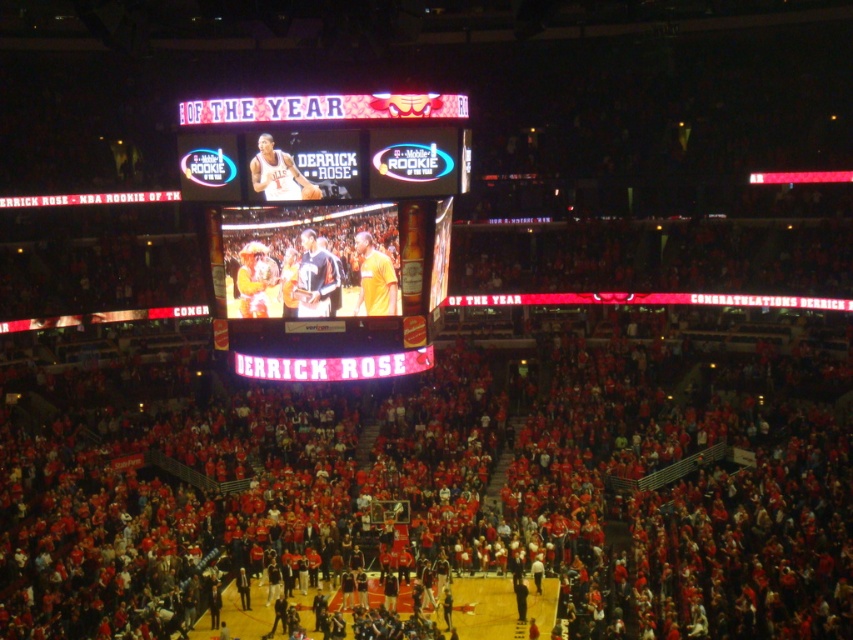
You are a photographer positioned at the entrance of the basketball arena. You want to take a photo of the matte plastic scoreboard at center. Which direction should you face to capture it in your shot?

The matte plastic scoreboard at center is located at point 0.366 on the x axis and 0.395 on the y axis, so you should face towards the center of the court to capture it in your shot.

You are a photographer trying to capture a photo of the matte white basketball at upper center without the matte plastic scoreboard at center blocking it. Based on the scene description, can you position yourself in a way to avoid the scoreboard blocking the basketball?

The matte plastic scoreboard at center is taller than the matte white basketball at upper center. Since the scoreboard is higher, positioning yourself lower or angling your camera downward might allow you to capture the basketball without the scoreboard blocking it.